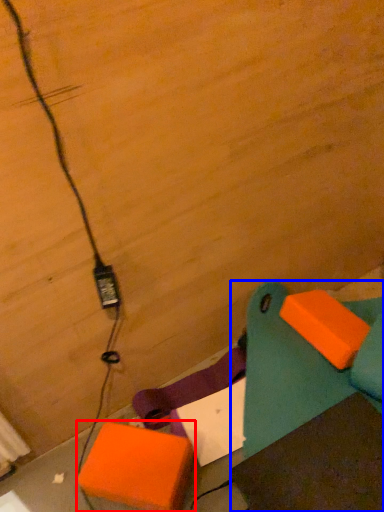
Question: Which object is further to the camera taking this photo, cardboard box (highlighted by a red box) or furniture (highlighted by a blue box)?

Choices:
 (A) cardboard box
 (B) furniture

Answer: (A)